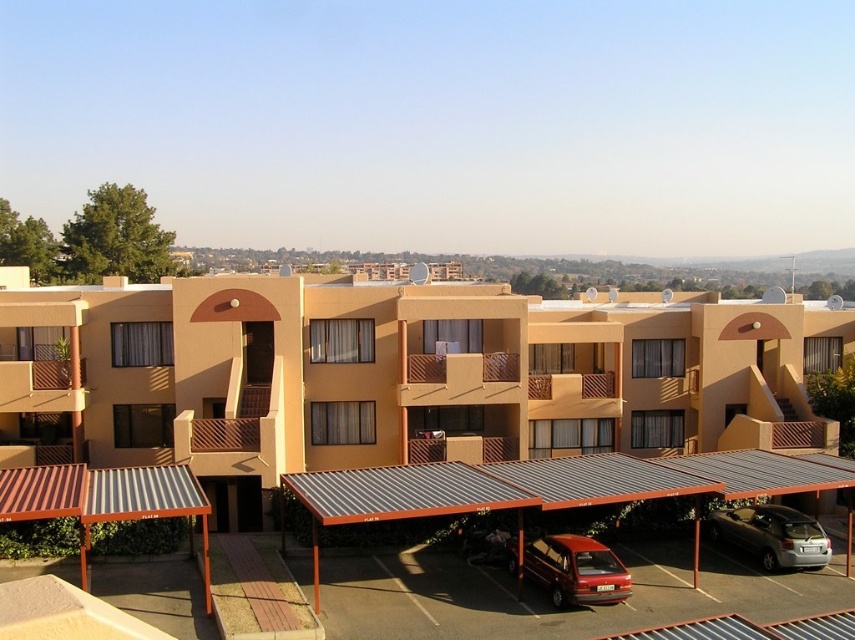
In the scene shown: You are a delivery person trying to park a new vehicle between the metallic red hatchback at lower center and the silver metallic car at lower right. Can the new vehicle fit if it is 1.8 meters wide?

The metallic red hatchback at lower center is wider than the silver metallic car at lower right. The available space between them depends on their combined widths. However, since the exact distance between the two cars isn

You are standing in front of the residential complex and notice the matte brown awning at lower left. Can you determine its exact position relative to the parking area?

The matte brown awning at lower left is located at point coordinates (394,376), which places it near the parking area in the lower left section of the image.